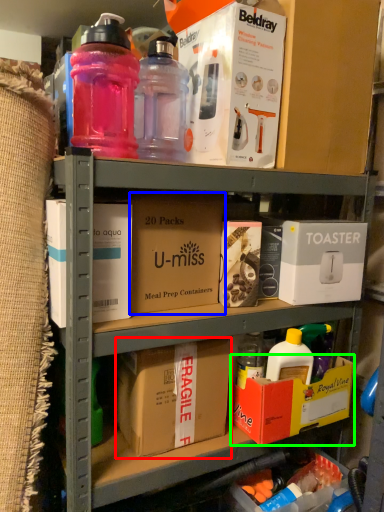
Question: Which object is positioned closest to cardboard box (highlighted by a red box)? Select from cardboard box (highlighted by a blue box) and box (highlighted by a green box).

Choices:
 (A) cardboard box
 (B) box

Answer: (B)